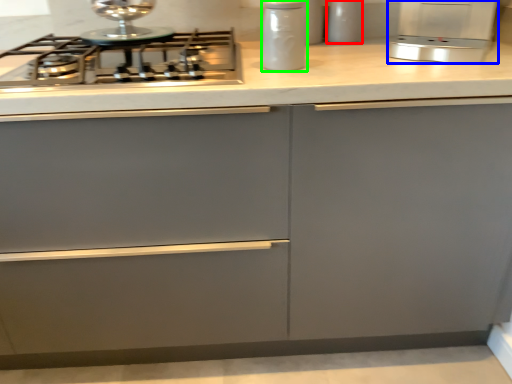
Question: Which object is the closest to the kitchen appliance (highlighted by a red box)? Choose among these: kitchen appliance (highlighted by a blue box) or kitchen appliance (highlighted by a green box).

Choices:
 (A) kitchen appliance
 (B) kitchen appliance

Answer: (A)